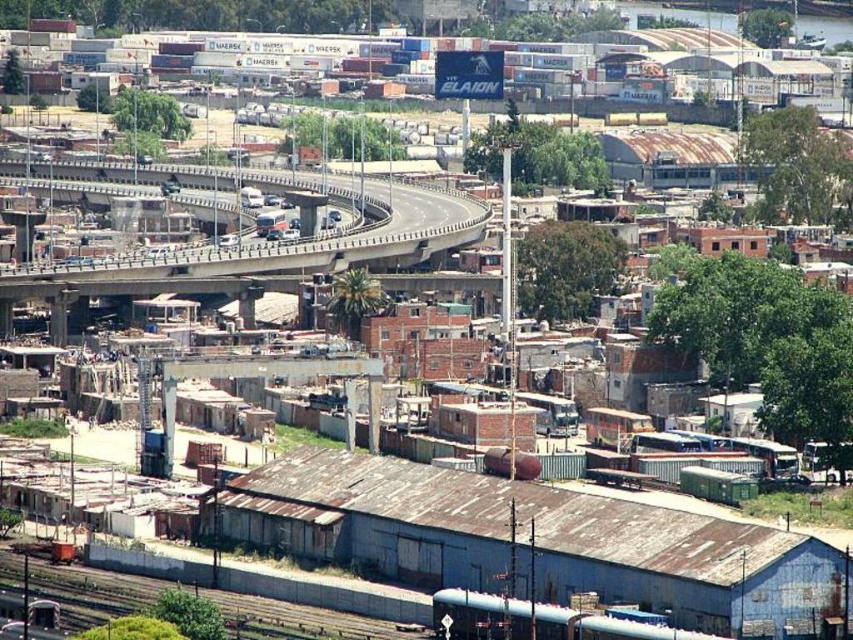
You are a city planner evaluating the urban layout. You need to determine if a new 10m wide pedestrian walkway can be constructed between the concrete bridge at upper center and the rusty metal train track at lower left. Based on their widths, can this be feasible?

The concrete bridge at upper center is wider than the rusty metal train track at lower left. However, the exact width of the bridge is not provided, so it is unclear if it can accommodate a 10m pedestrian walkway. Further measurements are needed.

You are a delivery driver who needs to cross the concrete bridge at upper center to reach the residential area. However, your truck is too heavy. Can you safely drive your truck over the rusty metal train track at lower left instead?

The concrete bridge at upper center is above the rusty metal train track at lower left, so the truck can safely use the rusty metal train track at lower left as an alternative route to reach the residential area instead of the bridge.

You are a delivery driver needing to cross the concrete bridge at upper center to reach a delivery point on the other side. However, there is a rusty metal train track at lower left blocking your path. Can you safely navigate around the track to reach the bridge?

The concrete bridge at upper center is closer to you than the rusty metal train track at lower left, so you can safely navigate around the track to reach the bridge.